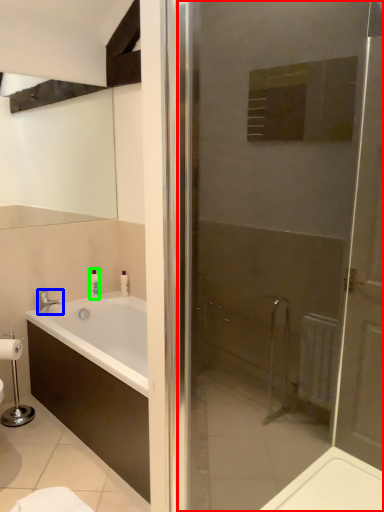
Question: Estimate the real-world distances between objects in this image. Which object is closer to door (highlighted by a red box), tap (highlighted by a blue box) or toiletry (highlighted by a green box)?

Choices:
 (A) tap
 (B) toiletry

Answer: (B)